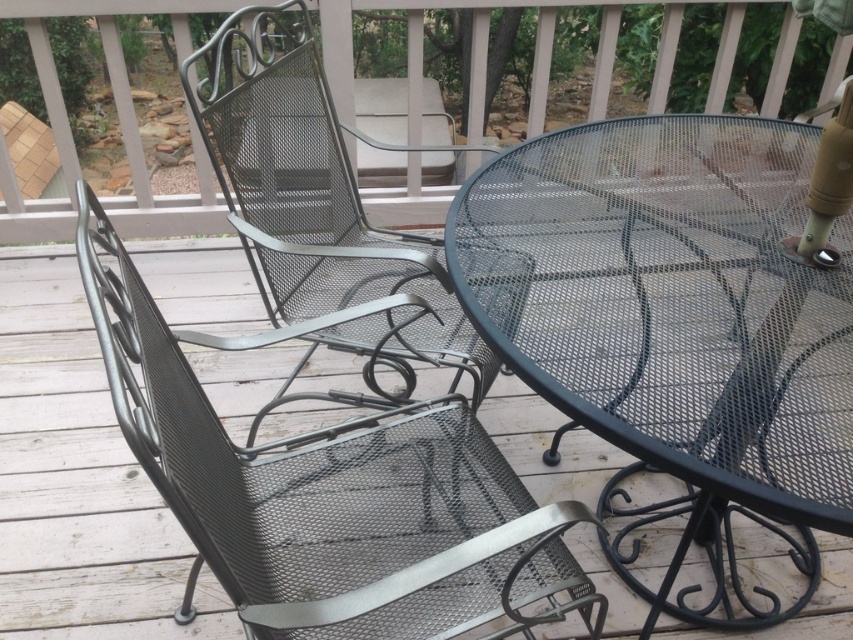
Does metal mesh swivel chair at left appear over metal mesh chair at upper left?

Incorrect, metal mesh swivel chair at left is not positioned above metal mesh chair at upper left.

At what (x,y) coordinates should I click in order to perform the action: click on metal mesh swivel chair at left. Please return your answer as a coordinate pair (x, y). The image size is (853, 640). Looking at the image, I should click on (331, 497).

Find the location of a particular element. black mesh table at center is located at coordinates (671, 310).

Is point (706, 166) positioned behind point (287, 8)?

No, it is in front of (287, 8).

This screenshot has height=640, width=853. I want to click on black mesh table at center, so click(671, 310).

In the scene shown: Does black mesh table at center appear over metal mesh swivel chair at left?

Indeed, black mesh table at center is positioned over metal mesh swivel chair at left.

Is black mesh table at center below metal mesh swivel chair at left?

No, black mesh table at center is not below metal mesh swivel chair at left.

Does point (610, 218) lie behind point (538, 557)?

Yes.

Find the location of a particular element. This screenshot has width=853, height=640. black mesh table at center is located at coordinates (671, 310).